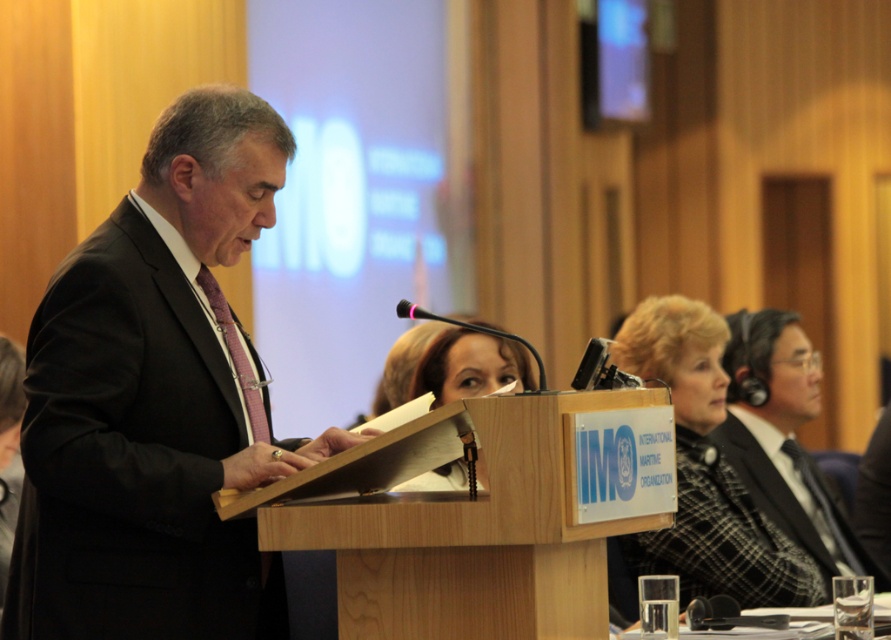
Question: Which point is closer to the camera?

Choices:
 (A) (723, 458)
 (B) (407, 628)
 (C) (491, 346)
 (D) (69, 602)

Answer: (D)

Question: Which is farther from the matte black headphones at center?

Choices:
 (A) black suit at left
 (B) wooden podium at center
 (C) black wool suit at right
 (D) plaid wool blazer at center

Answer: (B)

Question: Can you confirm if black suit at left is positioned to the right of plaid wool blazer at center?

Choices:
 (A) no
 (B) yes

Answer: (A)

Question: Which of the following is the closest to the observer?

Choices:
 (A) plaid wool blazer at center
 (B) black wool suit at right

Answer: (A)

Question: In this image, where is black suit at left located relative to plaid wool blazer at center?

Choices:
 (A) left
 (B) right

Answer: (A)

Question: Is matte black headphones at center further to the viewer compared to black wool suit at right?

Choices:
 (A) no
 (B) yes

Answer: (A)